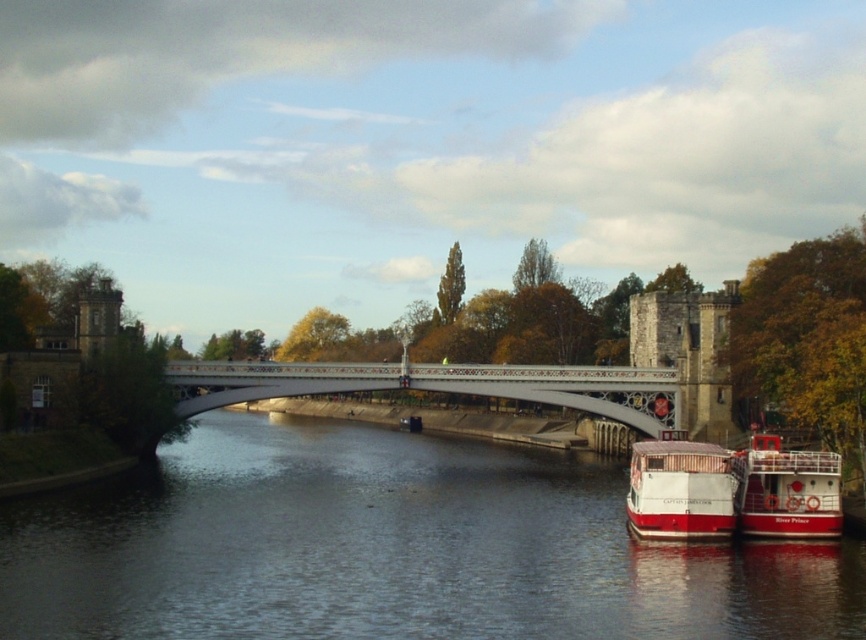
Question: Which point is closer to the camera?

Choices:
 (A) (792, 509)
 (B) (490, 368)
 (C) (462, 612)
 (D) (729, 493)

Answer: (C)

Question: Can you confirm if white matte boat at lower right is thinner than red matte boat at lower right?

Choices:
 (A) yes
 (B) no

Answer: (A)

Question: Is dark blue water at center thinner than white matte boat at lower right?

Choices:
 (A) no
 (B) yes

Answer: (A)

Question: Among these points, which one is nearest to the camera?

Choices:
 (A) (640, 538)
 (B) (789, 516)
 (C) (212, 588)
 (D) (572, 396)

Answer: (C)

Question: From the image, what is the correct spatial relationship of dark blue water at center in relation to red matte boat at lower right?

Choices:
 (A) below
 (B) above

Answer: (A)

Question: Which is farther from the red matte boat at lower right?

Choices:
 (A) white matte boat at lower right
 (B) white metallic bridge at center
 (C) dark blue water at center

Answer: (B)